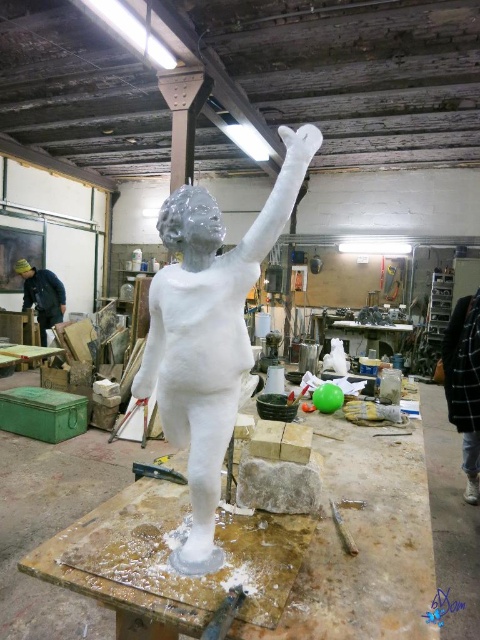
You are an artist who needs to place the black checkered jacket at right and the metallic silver tool at lower center into a storage box. The box can only hold items smaller than the jacket. Which item should you place first to ensure both fit?

The metallic silver tool at lower center should be placed first because the black checkered jacket at right is bigger and needs more space. By placing the smaller tool first, there will be enough room left for the larger jacket.

From the picture: You are an artist in the workshop and need to hang a tool on the wall between the black checkered jacket at right and the matte black jacket at left. Which jacket should you place the hook closer to to ensure the tool hangs higher?

The black checkered jacket at right is much taller than the matte black jacket at left, so placing the hook closer to the black checkered jacket at right will allow the tool to hang higher.

You are an artist who needs to place a new tool on the workbench. You have a black checkered jacket at right and a white matte statue at center. Which object should you place the tool closer to if you want it near the statue but away from the jacket?

You should place the tool closer to the white matte statue at center because it is positioned on the left side of the black checkered jacket at right, so placing it near the statue would naturally keep it away from the jacket.